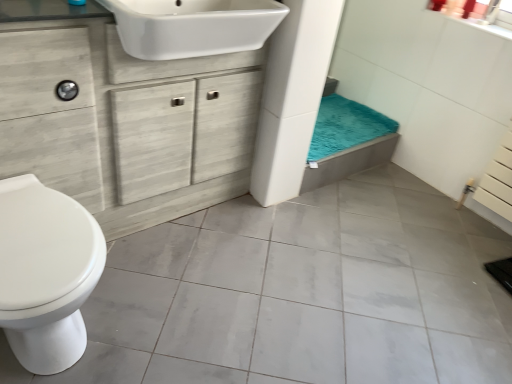
Question: Would you consider white wood cabinet at center to be distant from white glossy toilet at left?

Choices:
 (A) no
 (B) yes

Answer: (A)

Question: Can white glossy toilet at left be found inside white wood cabinet at center?

Choices:
 (A) yes
 (B) no

Answer: (B)

Question: Is white wood cabinet at center smaller than white glossy toilet at left?

Choices:
 (A) yes
 (B) no

Answer: (B)

Question: Is the position of white wood cabinet at center less distant than that of white glossy toilet at left?

Choices:
 (A) yes
 (B) no

Answer: (B)

Question: Is white wood cabinet at center bigger than white glossy toilet at left?

Choices:
 (A) yes
 (B) no

Answer: (A)

Question: Is point (231, 74) closer or farther from the camera than point (361, 107)?

Choices:
 (A) farther
 (B) closer

Answer: (B)

Question: Based on their sizes in the image, would you say white wood cabinet at center is bigger or smaller than teal plush bath towel at center?

Choices:
 (A) small
 (B) big

Answer: (B)

Question: From their relative heights in the image, would you say white wood cabinet at center is taller or shorter than teal plush bath towel at center?

Choices:
 (A) tall
 (B) short

Answer: (A)

Question: In terms of width, does white wood cabinet at center look wider or thinner when compared to teal plush bath towel at center?

Choices:
 (A) thin
 (B) wide

Answer: (A)

Question: In terms of height, does white glossy sink at upper center look taller or shorter compared to white glossy toilet at left?

Choices:
 (A) tall
 (B) short

Answer: (B)

Question: Considering the positions of point (114, 8) and point (1, 251), is point (114, 8) closer or farther from the camera than point (1, 251)?

Choices:
 (A) farther
 (B) closer

Answer: (A)

Question: Looking at their shapes, would you say white glossy sink at upper center is wider or thinner than white glossy toilet at left?

Choices:
 (A) wide
 (B) thin

Answer: (B)

Question: Considering the relative positions of white glossy sink at upper center and white glossy toilet at left in the image provided, is white glossy sink at upper center to the left or to the right of white glossy toilet at left?

Choices:
 (A) left
 (B) right

Answer: (B)

Question: Is white glossy sink at upper center in front of or behind teal plush bath towel at center in the image?

Choices:
 (A) behind
 (B) front

Answer: (B)

Question: Is white glossy sink at upper center to the left or to the right of teal plush bath towel at center in the image?

Choices:
 (A) right
 (B) left

Answer: (B)